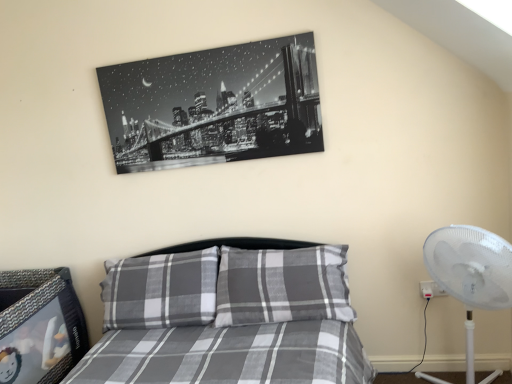
This screenshot has width=512, height=384. What are the coordinates of `gray plaid bed at center` in the screenshot? It's located at (227, 320).

From the image's perspective, is black glossy print at upper center located above white plastic fan at right?

Yes, from the image's perspective, black glossy print at upper center is on top of white plastic fan at right.

Which of these two, black glossy print at upper center or white plastic fan at right, is smaller?

black glossy print at upper center.

Does black glossy print at upper center lie behind white plastic fan at right?

That is True.

Is black glossy print at upper center oriented away from white plastic fan at right?

No, black glossy print at upper center is not facing away from white plastic fan at right.

Is white plastic fan at right completely or partially outside of black glossy print at upper center?

white plastic fan at right is positioned outside black glossy print at upper center.

Which object is closer to the camera taking this photo, white plastic fan at right or black glossy print at upper center?

Positioned in front is white plastic fan at right.

Considering the sizes of objects white plastic fan at right and black glossy print at upper center in the image provided, who is bigger, white plastic fan at right or black glossy print at upper center?

white plastic fan at right is bigger.

How different are the orientations of white plastic fan at right and black glossy print at upper center in degrees?

The facing directions of white plastic fan at right and black glossy print at upper center are 0.551 degrees apart.

Considering the positions of objects gray plaid bed at center and black glossy print at upper center in the image provided, who is in front, gray plaid bed at center or black glossy print at upper center?

gray plaid bed at center is in front.

Is gray plaid bed at center taller than black glossy print at upper center?

Yes.

Can you confirm if gray plaid bed at center is wider than black glossy print at upper center?

Correct, the width of gray plaid bed at center exceeds that of black glossy print at upper center.

Is gray plaid bed at center touching black glossy print at upper center?

No, gray plaid bed at center is not touching black glossy print at upper center.

Is black glossy print at upper center shorter than gray plaid bed at center?

Yes, black glossy print at upper center is shorter than gray plaid bed at center.

Image resolution: width=512 pixels, height=384 pixels. Identify the location of picture frame to the left of gray plaid bed at center. point(214,105).

Is point (290, 124) closer or farther from the camera than point (206, 317)?

Point (290, 124) is farther from the camera than point (206, 317).

From the image's perspective, which one is positioned lower, gray plaid bed at center or white plastic fan at right?

From the image's view, gray plaid bed at center is below.

Considering the relative sizes of gray plaid bed at center and white plastic fan at right in the image provided, is gray plaid bed at center smaller than white plastic fan at right?

Incorrect, gray plaid bed at center is not smaller in size than white plastic fan at right.

Would you say gray plaid bed at center is a long distance from white plastic fan at right?

That's not correct — gray plaid bed at center is a little close to white plastic fan at right.

Considering the positions of objects gray plaid bed at center and white plastic fan at right in the image provided, who is more to the right, gray plaid bed at center or white plastic fan at right?

white plastic fan at right.

Which is more to the right, white plastic fan at right or gray plaid bed at center?

Positioned to the right is white plastic fan at right.

Measure the distance between white plastic fan at right and gray plaid bed at center.

white plastic fan at right is 36.39 inches away from gray plaid bed at center.

Is white plastic fan at right taller than gray plaid bed at center?

Indeed, white plastic fan at right has a greater height compared to gray plaid bed at center.

From a real-world perspective, which object stands above the other?

From a 3D spatial view, white plastic fan at right is above.

In the image, there is a white plastic fan at right. What are the coordinates of `picture frame above it (from the image's perspective)` in the screenshot? It's located at [214, 105].

Locate an element on the screen. Image resolution: width=512 pixels, height=384 pixels. mechanical fan that is under the black glossy print at upper center (from a real-world perspective) is located at coordinates [471, 273].

When comparing their distances from white plastic fan at right, does black glossy print at upper center or gray plaid bed at center seem further?

black glossy print at upper center is further to white plastic fan at right.

Considering their positions, is black glossy print at upper center positioned further to gray plaid bed at center than white plastic fan at right?

white plastic fan at right lies further to gray plaid bed at center than the other object.

Looking at the image, which one is located further to black glossy print at upper center, white plastic fan at right or gray plaid bed at center?

white plastic fan at right is positioned further to the anchor black glossy print at upper center.

Looking at this image, based on their spatial positions, is gray plaid bed at center or black glossy print at upper center closer to white plastic fan at right?

Among the two, gray plaid bed at center is located nearer to white plastic fan at right.

Looking at the image, which one is located further to black glossy print at upper center, gray plaid bed at center or white plastic fan at right?

Based on the image, white plastic fan at right appears to be further to black glossy print at upper center.

Based on their spatial positions, is white plastic fan at right or black glossy print at upper center further from gray plaid bed at center?

Among the two, white plastic fan at right is located further to gray plaid bed at center.

At what (x,y) coordinates should I click in order to perform the action: click on bed situated between black glossy print at upper center and white plastic fan at right from left to right. Please return your answer as a coordinate pair (x, y). This screenshot has width=512, height=384. Looking at the image, I should click on (227, 320).